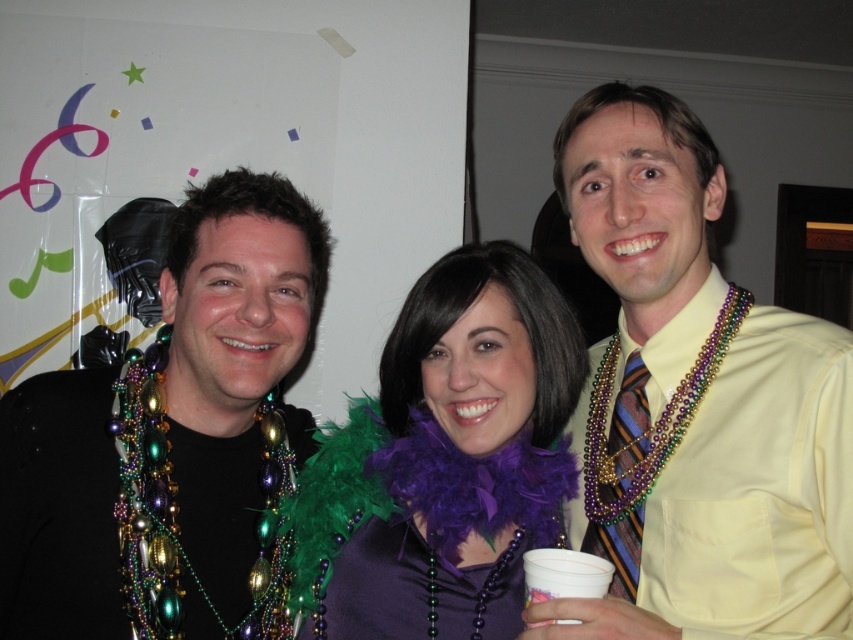
Question: Which object appears closest to the camera in this image?

Choices:
 (A) striped silk tie at center-right
 (B) purple feather boa at center
 (C) yellow satin shirt at center
 (D) metallic beaded necklace at left

Answer: (C)

Question: Which point is closer to the camera taking this photo?

Choices:
 (A) (219, 529)
 (B) (689, 397)

Answer: (B)

Question: Is metallic beaded necklace at left thinner than striped silk tie at center-right?

Choices:
 (A) no
 (B) yes

Answer: (A)

Question: Does yellow satin shirt at center have a lesser width compared to metallic beaded necklace at left?

Choices:
 (A) no
 (B) yes

Answer: (A)

Question: Which object is positioned closest to the yellow satin shirt at center?

Choices:
 (A) metallic beaded necklace at left
 (B) striped silk tie at center-right
 (C) purple feather boa at center

Answer: (B)

Question: Can you confirm if purple feather boa at center is bigger than striped silk tie at center-right?

Choices:
 (A) yes
 (B) no

Answer: (A)